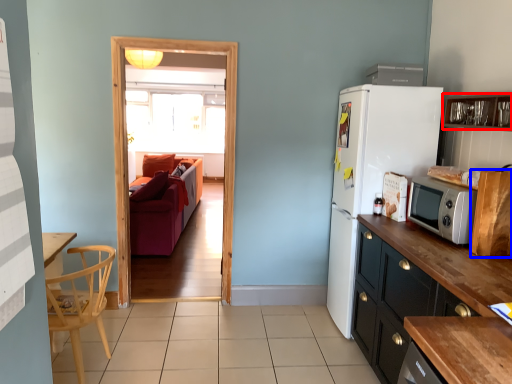
Question: Which object is closer to the camera taking this photo, cabinetry (highlighted by a red box) or cabinetry (highlighted by a blue box)?

Choices:
 (A) cabinetry
 (B) cabinetry

Answer: (A)